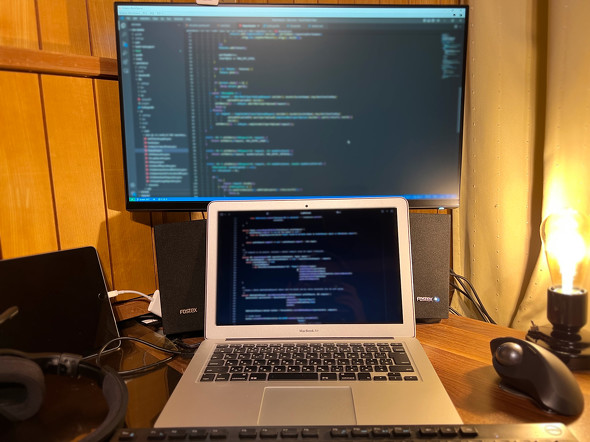
Where is `light bulb`? light bulb is located at coordinates (563, 241).